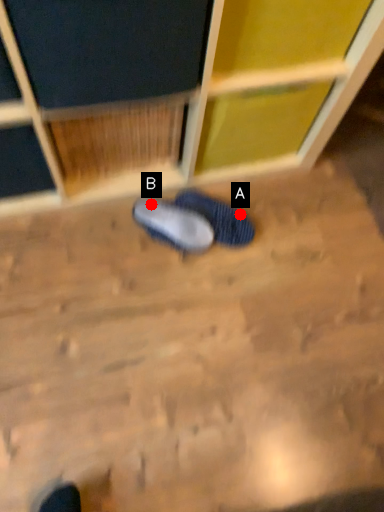
Question: Two points are circled on the image, labeled by A and B beside each circle. Which of the following is the closest to the observer?

Choices:
 (A) A is closer
 (B) B is closer

Answer: (B)